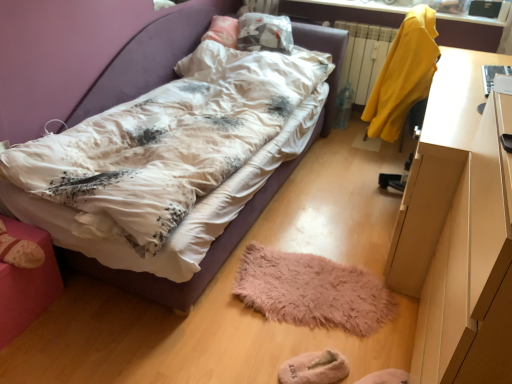
Question: Is yellow fabric coat at upper right surrounded by white glossy desk at right?

Choices:
 (A) yes
 (B) no

Answer: (B)

Question: From the image's perspective, is white glossy desk at right over yellow fabric coat at upper right?

Choices:
 (A) yes
 (B) no

Answer: (B)

Question: Is white glossy desk at right in front of yellow fabric coat at upper right?

Choices:
 (A) yes
 (B) no

Answer: (A)

Question: Can you confirm if white glossy desk at right is taller than yellow fabric coat at upper right?

Choices:
 (A) yes
 (B) no

Answer: (A)

Question: Does white glossy desk at right appear on the left side of yellow fabric coat at upper right?

Choices:
 (A) no
 (B) yes

Answer: (B)

Question: Is pink suede shoe at lower left wider or thinner than beige fuzzy slippers at lower center?

Choices:
 (A) wide
 (B) thin

Answer: (A)

Question: Considering the relative positions of pink suede shoe at lower left and beige fuzzy slippers at lower center in the image provided, is pink suede shoe at lower left to the left or to the right of beige fuzzy slippers at lower center?

Choices:
 (A) right
 (B) left

Answer: (B)

Question: From a real-world perspective, is pink suede shoe at lower left physically located above or below beige fuzzy slippers at lower center?

Choices:
 (A) below
 (B) above

Answer: (B)

Question: Is point (19, 251) closer or farther from the camera than point (332, 357)?

Choices:
 (A) closer
 (B) farther

Answer: (A)

Question: Considering the positions of fuzzy pink mat at center and pink suede shoe at lower left in the image, is fuzzy pink mat at center bigger or smaller than pink suede shoe at lower left?

Choices:
 (A) big
 (B) small

Answer: (A)

Question: Is fuzzy pink mat at center taller or shorter than pink suede shoe at lower left?

Choices:
 (A) tall
 (B) short

Answer: (B)

Question: Is fuzzy pink mat at center in front of or behind pink suede shoe at lower left in the image?

Choices:
 (A) front
 (B) behind

Answer: (B)

Question: From a real-world perspective, is fuzzy pink mat at center above or below pink suede shoe at lower left?

Choices:
 (A) above
 (B) below

Answer: (B)

Question: Based on their sizes in the image, would you say pink suede shoe at lower left is bigger or smaller than matte white bed at center?

Choices:
 (A) big
 (B) small

Answer: (B)

Question: In terms of height, does pink suede shoe at lower left look taller or shorter compared to matte white bed at center?

Choices:
 (A) tall
 (B) short

Answer: (B)